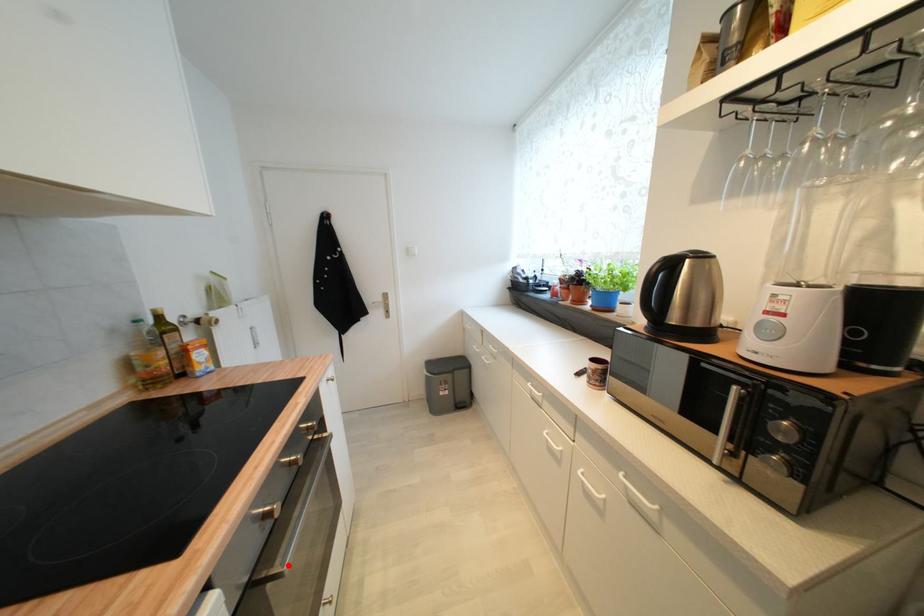
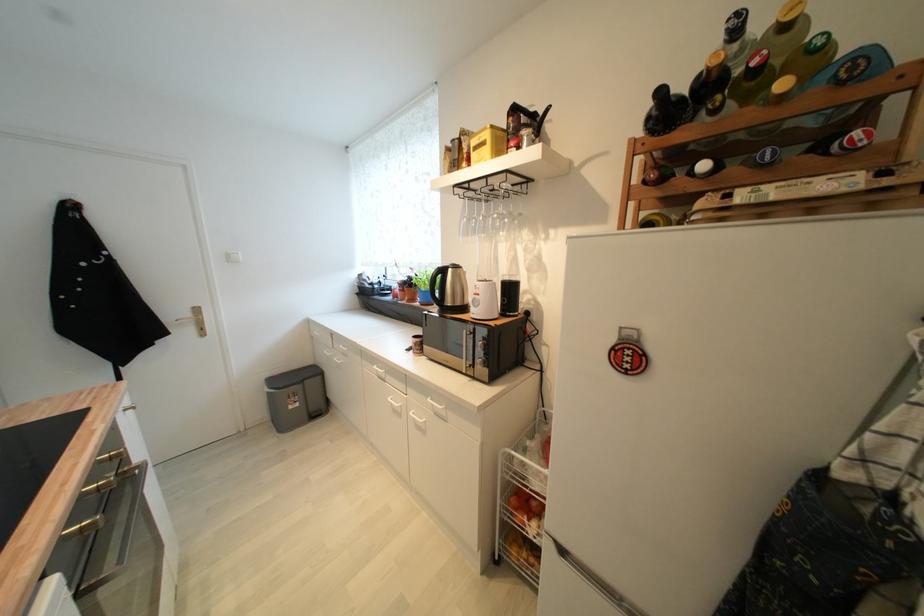
Question: I am providing you with two images of the same scene from different viewpoints. In image1, a red point is highlighted. Considering the same 3D point in image2, which of the following is correct?

Choices:
 (A) It is closer
 (B) It is farther

Answer: (B)